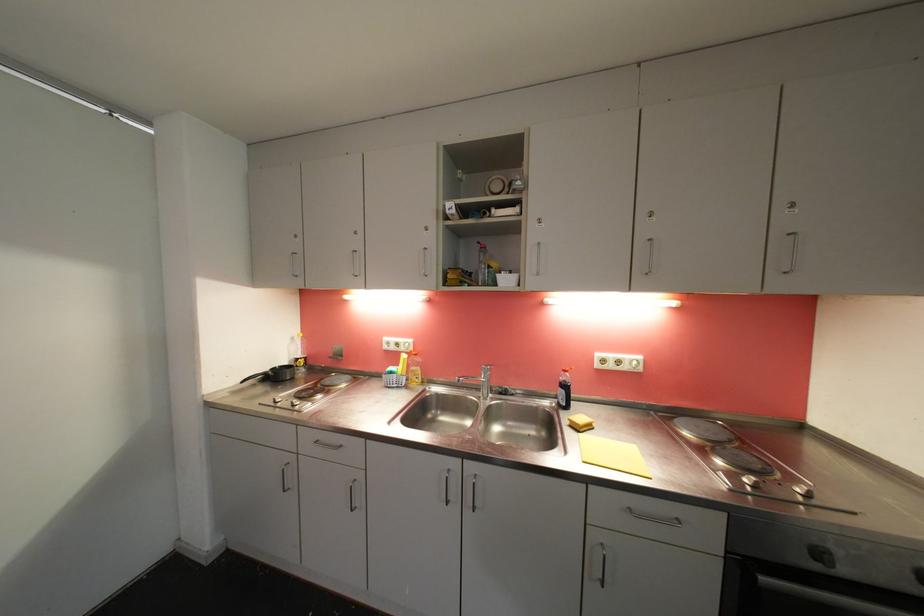
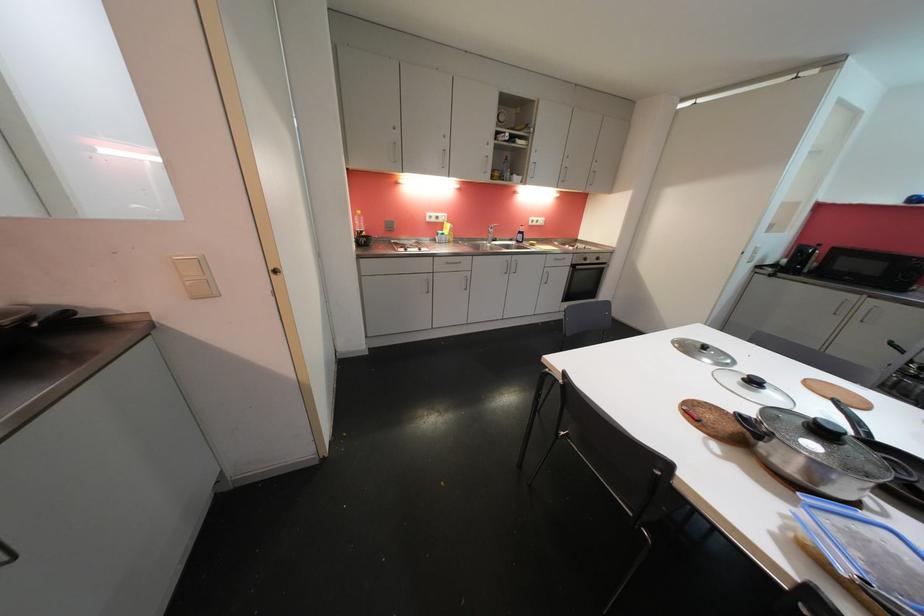
In the second image, find the point that corresponds to the point at 824,557 in the first image.

(590, 262)